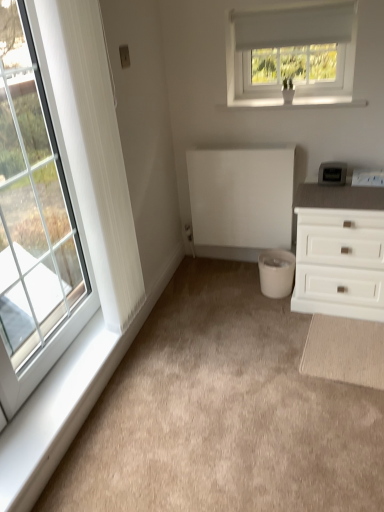
Question: Should I look upward or downward to see white plastic window sill at lower left, the second window sill positioned from the top?

Choices:
 (A) down
 (B) up

Answer: (A)

Question: Considering the relative positions of white plastic window sill at upper center, positioned as the first window sill in right-to-left order, and white textured curtain at left in the image provided, is white plastic window sill at upper center, positioned as the first window sill in right-to-left order, to the right of white textured curtain at left from the viewer's perspective?

Choices:
 (A) no
 (B) yes

Answer: (B)

Question: Does white plastic window sill at upper center, positioned as the first window sill in right-to-left order, have a greater width compared to white textured curtain at left?

Choices:
 (A) yes
 (B) no

Answer: (A)

Question: From the image's perspective, is white plastic window sill at upper center, which is the 2th window sill from bottom to top, located beneath white textured curtain at left?

Choices:
 (A) yes
 (B) no

Answer: (B)

Question: From a real-world perspective, is white plastic window sill at upper center, the 1th window sill from the top, over white textured curtain at left?

Choices:
 (A) no
 (B) yes

Answer: (B)

Question: From the image's perspective, is white plastic window sill at upper center, the 1th window sill from the top, above white textured curtain at left?

Choices:
 (A) no
 (B) yes

Answer: (B)

Question: Is white plastic window sill at upper center, which is the second window sill in left-to-right order, thinner than white textured curtain at left?

Choices:
 (A) yes
 (B) no

Answer: (B)

Question: Does white matte radiator at center have a greater width compared to white matte chest of drawers at right?

Choices:
 (A) yes
 (B) no

Answer: (B)

Question: Is white matte radiator at center positioned with its back to white matte chest of drawers at right?

Choices:
 (A) no
 (B) yes

Answer: (A)

Question: From the image's perspective, is white matte radiator at center beneath white matte chest of drawers at right?

Choices:
 (A) yes
 (B) no

Answer: (B)

Question: From the image's perspective, is white matte radiator at center over white matte chest of drawers at right?

Choices:
 (A) yes
 (B) no

Answer: (A)

Question: From a real-world perspective, is white matte radiator at center located higher than white matte chest of drawers at right?

Choices:
 (A) yes
 (B) no

Answer: (A)

Question: Can you confirm if white matte radiator at center is thinner than white matte chest of drawers at right?

Choices:
 (A) yes
 (B) no

Answer: (A)

Question: From a real-world perspective, does beige carpet at center sit lower than white plastic window sill at lower left, positioned as the second window sill in right-to-left order?

Choices:
 (A) no
 (B) yes

Answer: (B)